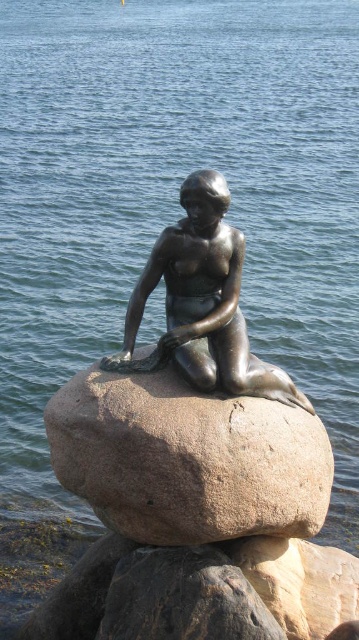
Who is lower down, brown granite rock at center or bronze statue at center?

Positioned lower is brown granite rock at center.

Is brown granite rock at center further to camera compared to bronze statue at center?

No, brown granite rock at center is in front of bronze statue at center.

This screenshot has width=359, height=640. I want to click on brown granite rock at center, so click(x=188, y=460).

This screenshot has height=640, width=359. Identify the location of brown granite rock at center. (188, 460).